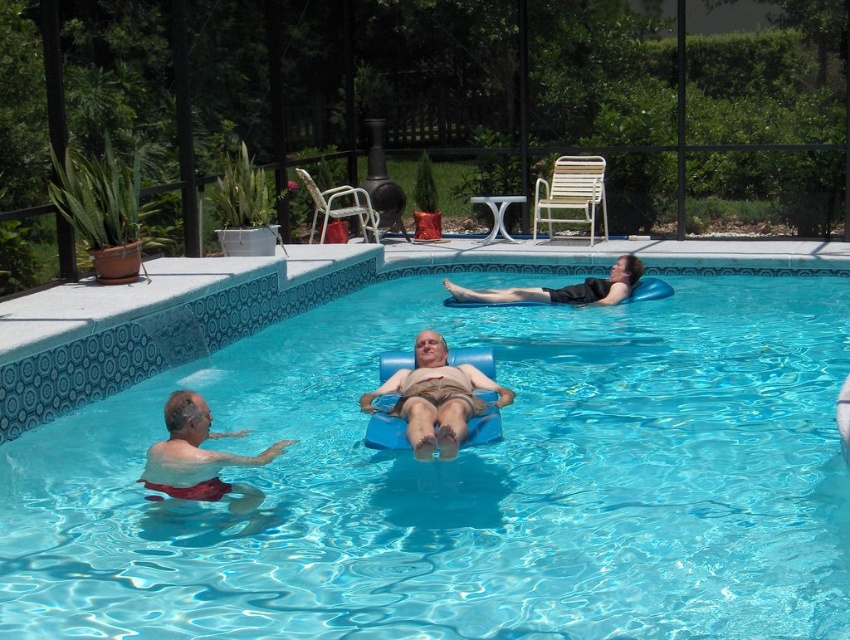
Does white matte shorts at lower left have a larger size compared to black fabric float at upper center?

Actually, white matte shorts at lower left might be smaller than black fabric float at upper center.

Does white matte shorts at lower left appear on the right side of black fabric float at upper center?

Incorrect, white matte shorts at lower left is not on the right side of black fabric float at upper center.

The width and height of the screenshot is (850, 640). I want to click on white matte shorts at lower left, so click(x=199, y=458).

The width and height of the screenshot is (850, 640). What are the coordinates of `white matte shorts at lower left` in the screenshot? It's located at (199, 458).

Is smooth tan skin at center bigger than black fabric float at upper center?

Yes.

Does point (429, 385) come behind point (502, 301)?

That is False.

The height and width of the screenshot is (640, 850). What do you see at coordinates (435, 397) in the screenshot?
I see `smooth tan skin at center` at bounding box center [435, 397].

Identify the location of smooth tan skin at center. The height and width of the screenshot is (640, 850). click(x=435, y=397).

Is point (714, 502) farther from viewer compared to point (496, 298)?

No, it is not.

Which is in front, point (836, 456) or point (639, 275)?

Positioned in front is point (836, 456).

Is point (537, 339) positioned after point (595, 301)?

That is False.

This screenshot has height=640, width=850. I want to click on transparent blue water at center, so click(x=468, y=483).